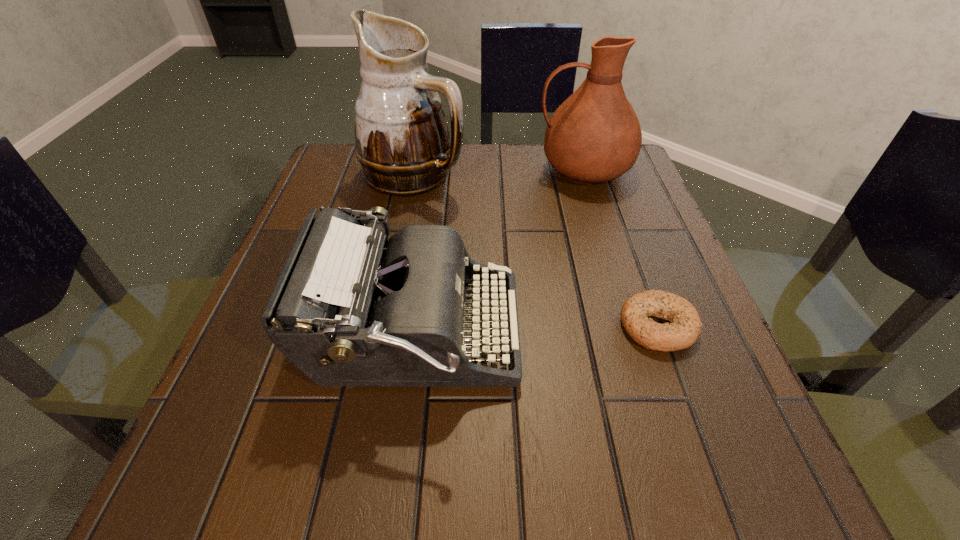
Choose which object is the second nearest neighbor to the left pitcher. Please provide its 2D coordinates. Your answer should be formatted as a tuple, i.e. [(x, y)], where the tuple contains the x and y coordinates of a point satisfying the conditions above.

[(346, 312)]

At what (x,y) coordinates should I click in order to perform the action: click on object that stands as the third closest to the typewriter. Please return your answer as a coordinate pair (x, y). This screenshot has width=960, height=540. Looking at the image, I should click on (594, 136).

This screenshot has height=540, width=960. I want to click on free spot that satisfies the following two spatial constraints: 1. on the front side of the bagel; 2. on the front-facing side of the typewriter, so click(x=660, y=335).

Find the location of a particular element. vacant space that satisfies the following two spatial constraints: 1. on the side of the right pitcher with the handle; 2. on the left side of the shortest object is located at coordinates [x=632, y=326].

I want to click on free space that satisfies the following two spatial constraints: 1. from the spout of the left pitcher; 2. on the right side of the bagel, so click(385, 326).

What are the coordinates of `free location that satisfies the following two spatial constraints: 1. on the side of the right pitcher with the handle; 2. on the back side of the shortest object` in the screenshot? It's located at (632, 326).

Identify the location of vacant space that satisfies the following two spatial constraints: 1. from the spout of the left pitcher; 2. on the left side of the bagel. The width and height of the screenshot is (960, 540). (385, 326).